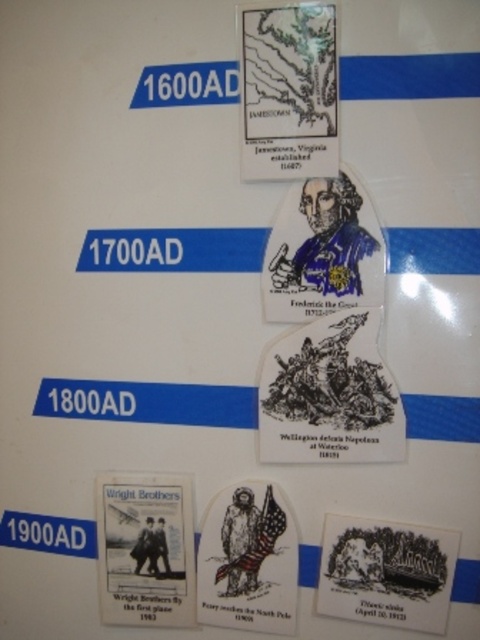
Question: Can you confirm if matte paper map at upper center is smaller than white paper flag at lower center?

Choices:
 (A) yes
 (B) no

Answer: (B)

Question: Does matte paper map at upper center have a smaller size compared to white paper wright brothers poster at lower left?

Choices:
 (A) no
 (B) yes

Answer: (A)

Question: Which point appears farthest from the camera in this image?

Choices:
 (A) (227, 508)
 (B) (119, 483)
 (C) (420, 624)

Answer: (B)

Question: Estimate the real-world distances between objects in this image. Which object is farther from the matte paper map at upper center?

Choices:
 (A) white paper flag at lower center
 (B) white paper wright brothers poster at lower left

Answer: (B)

Question: Can you confirm if matte paper map at upper center is positioned below white paper wright brothers poster at lower left?

Choices:
 (A) no
 (B) yes

Answer: (A)

Question: Which object is the farthest from the matte paper map at upper center?

Choices:
 (A) white paper wright brothers poster at lower left
 (B) white paper flag at lower center

Answer: (A)